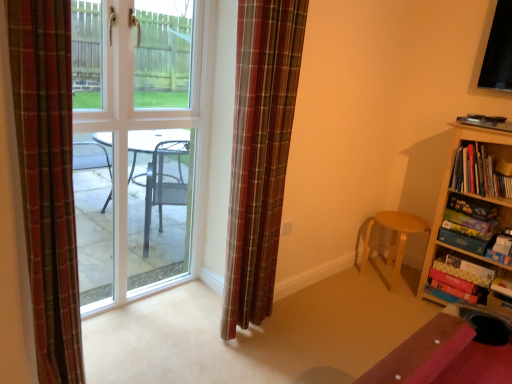
Question: Is plaid fabric curtain at left, the 1th curtain viewed from the front, to the left or to the right of plaid fabric curtain at center, arranged as the second curtain when viewed from the front, in the image?

Choices:
 (A) right
 (B) left

Answer: (B)

Question: Is plaid fabric curtain at left, the 1th curtain viewed from the front, inside or outside of plaid fabric curtain at center, which appears as the 2th curtain when viewed from the left?

Choices:
 (A) outside
 (B) inside

Answer: (A)

Question: Considering the real-world distances, which object is closest to the hardcover book at right?

Choices:
 (A) wooden bookshelf at right
 (B) clear glass door at center
 (C) light brown wooden stool at lower right
 (D) plaid fabric curtain at left, the 1th curtain viewed from the front
 (E) plaid fabric curtain at center, arranged as the second curtain when viewed from the front

Answer: (A)

Question: Estimate the real-world distances between objects in this image. Which object is farther from the plaid fabric curtain at center, arranged as the second curtain when viewed from the front?

Choices:
 (A) clear glass door at center
 (B) hardcover book at right
 (C) wooden bookshelf at right
 (D) plaid fabric curtain at left, the 1th curtain viewed from the front
 (E) light brown wooden stool at lower right

Answer: (B)